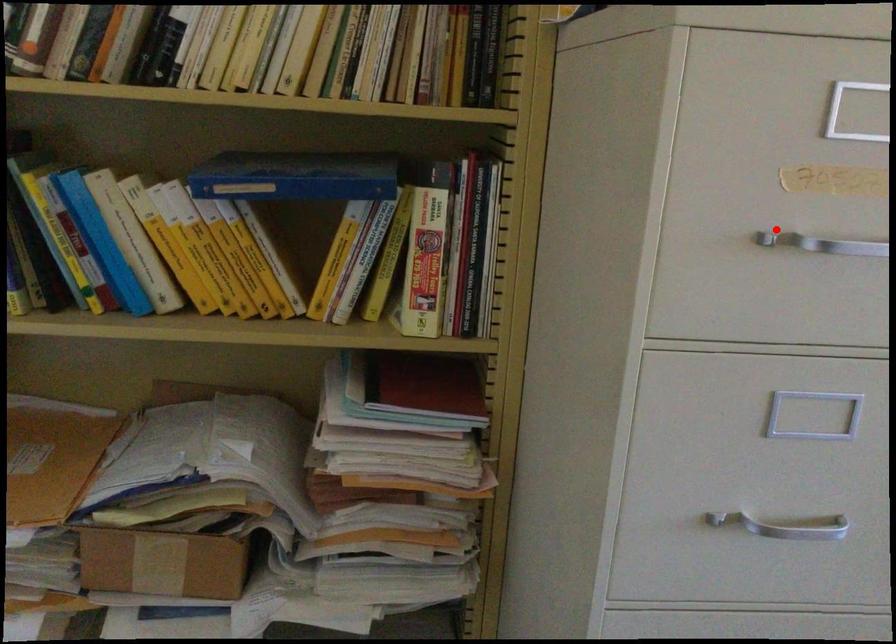
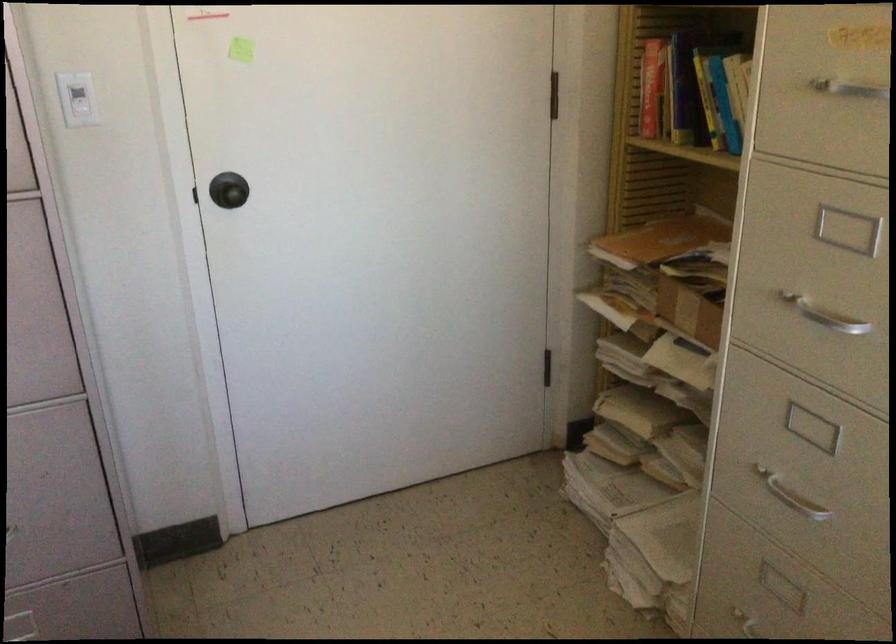
Question: I am providing you with two images of the same scene from different viewpoints. Given a red point in image1, look at the same physical point in image2. Is it:

Choices:
 (A) Closer to the viewpoint
 (B) Farther from the viewpoint

Answer: (B)